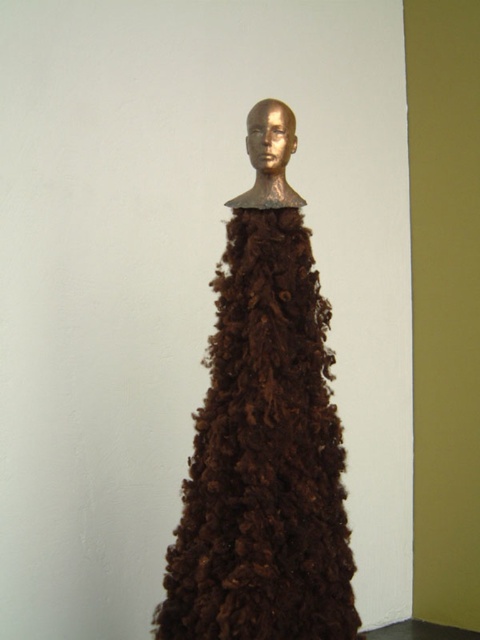
Question: From the image, what is the correct spatial relationship of brown fluffy dress at center in relation to gold metallic head at center?

Choices:
 (A) below
 (B) above

Answer: (A)

Question: Is brown fluffy dress at center wider than gold metallic head at center?

Choices:
 (A) no
 (B) yes

Answer: (B)

Question: Is brown fluffy dress at center wider than gold metallic head at center?

Choices:
 (A) yes
 (B) no

Answer: (A)

Question: Which object is closer to the camera taking this photo?

Choices:
 (A) brown fluffy dress at center
 (B) gold metallic head at center

Answer: (A)